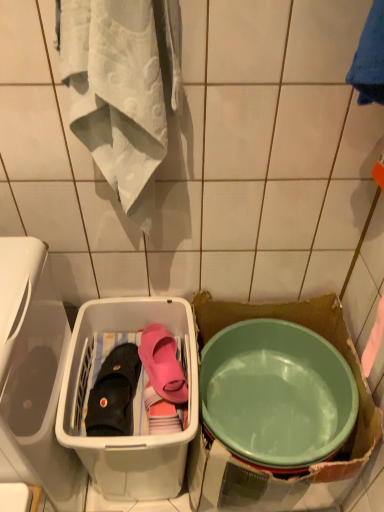
Question: Is green plastic bowl at lower right aimed at black fabric slipper at lower left, positioned as the second footwear in right-to-left order?

Choices:
 (A) yes
 (B) no

Answer: (B)

Question: Does green plastic bowl at lower right have a lesser width compared to black fabric slipper at lower left, the 1th footwear when ordered from left to right?

Choices:
 (A) no
 (B) yes

Answer: (A)

Question: Does green plastic bowl at lower right have a lesser height compared to black fabric slipper at lower left, the 1th footwear when ordered from left to right?

Choices:
 (A) yes
 (B) no

Answer: (B)

Question: Is green plastic bowl at lower right to the left of black fabric slipper at lower left, positioned as the second footwear in right-to-left order, from the viewer's perspective?

Choices:
 (A) no
 (B) yes

Answer: (A)

Question: From the image's perspective, is green plastic bowl at lower right located above black fabric slipper at lower left, positioned as the second footwear in right-to-left order?

Choices:
 (A) yes
 (B) no

Answer: (B)

Question: Looking at the image, does green plastic bowl at lower right seem bigger or smaller compared to pink rubber slipper at center, placed as the 1th footwear when sorted from right to left?

Choices:
 (A) small
 (B) big

Answer: (B)

Question: Is green plastic bowl at lower right inside or outside of pink rubber slipper at center, placed as the 1th footwear when sorted from right to left?

Choices:
 (A) inside
 (B) outside

Answer: (B)

Question: Looking at their shapes, would you say green plastic bowl at lower right is wider or thinner than pink rubber slipper at center, placed as the 1th footwear when sorted from right to left?

Choices:
 (A) wide
 (B) thin

Answer: (A)

Question: Considering the relative positions of green plastic bowl at lower right and pink rubber slipper at center, placed as the 1th footwear when sorted from right to left, in the image provided, is green plastic bowl at lower right to the left or to the right of pink rubber slipper at center, placed as the 1th footwear when sorted from right to left,?

Choices:
 (A) left
 (B) right

Answer: (B)

Question: In the image, is translucent plastic basket at center on the left side or the right side of green plastic bowl at lower right?

Choices:
 (A) right
 (B) left

Answer: (B)

Question: Is translucent plastic basket at center wider or thinner than green plastic bowl at lower right?

Choices:
 (A) wide
 (B) thin

Answer: (B)

Question: Is translucent plastic basket at center situated inside green plastic bowl at lower right or outside?

Choices:
 (A) inside
 (B) outside

Answer: (B)

Question: From the image's perspective, is translucent plastic basket at center located above or below green plastic bowl at lower right?

Choices:
 (A) above
 (B) below

Answer: (B)

Question: Based on their sizes in the image, would you say pink rubber slipper at center, placed as the 1th footwear when sorted from right to left, is bigger or smaller than green plastic bowl at lower right?

Choices:
 (A) small
 (B) big

Answer: (A)

Question: Considering the positions of pink rubber slipper at center, placed as the 1th footwear when sorted from right to left, and green plastic bowl at lower right in the image, is pink rubber slipper at center, placed as the 1th footwear when sorted from right to left, taller or shorter than green plastic bowl at lower right?

Choices:
 (A) tall
 (B) short

Answer: (B)